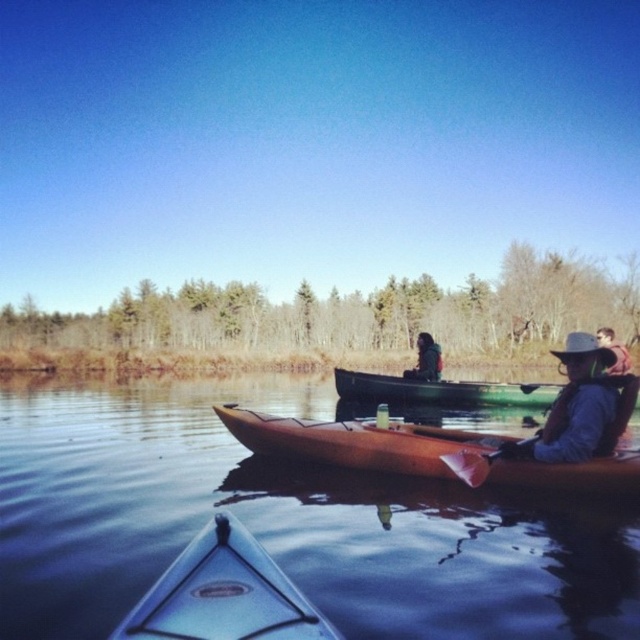
Question: Is pink foam paddle at center smaller than dark brown leather jacket at center?

Choices:
 (A) yes
 (B) no

Answer: (A)

Question: Which point is farther from the camera taking this photo?

Choices:
 (A) (93, 616)
 (B) (625, 362)
 (C) (417, 444)
 (D) (420, 355)

Answer: (D)

Question: Among these points, which one is farthest from the camera?

Choices:
 (A) (412, 397)
 (B) (605, 332)

Answer: (A)

Question: Is brown leather jacket at lower right smaller than green plastic canoe at center?

Choices:
 (A) no
 (B) yes

Answer: (B)

Question: Which object is the farthest from the brown matte water at center?

Choices:
 (A) light blue plastic kayak at lower center
 (B) smooth brown leather jacket at right
 (C) green plastic canoe at center
 (D) dark brown leather jacket at center

Answer: (B)

Question: Can you confirm if light blue plastic kayak at lower center is bigger than pink foam paddle at center?

Choices:
 (A) yes
 (B) no

Answer: (B)